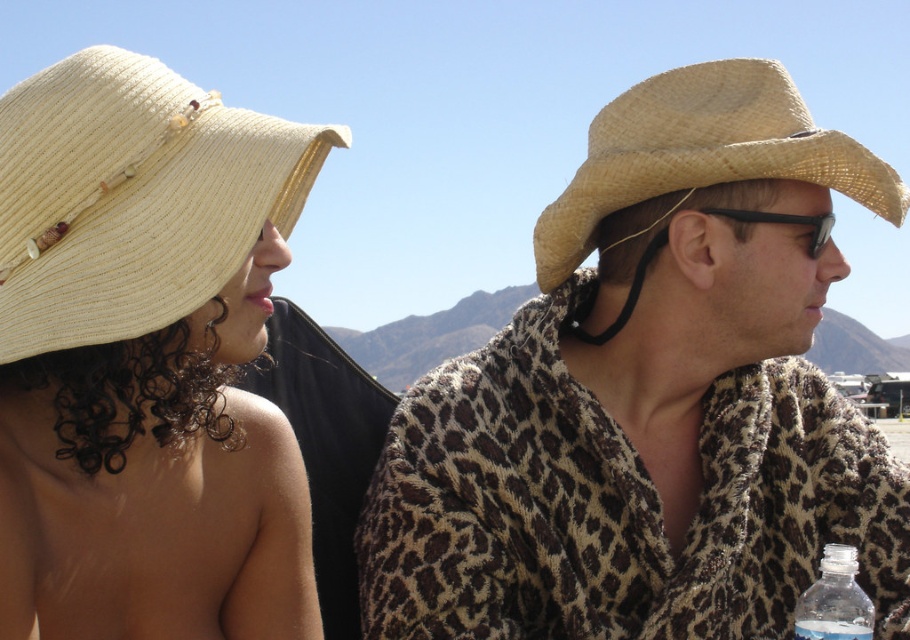
Does leopard print towel at center lie behind straw hat at left?

Yes, it is behind straw hat at left.

In the scene shown: Which is more to the left, leopard print towel at center or straw hat at left?

straw hat at left is more to the left.

Does point (659, 147) come farther from viewer compared to point (6, 276)?

Yes, it is.

I want to click on leopard print towel at center, so [650, 397].

Does point (836, 547) lie behind point (801, 221)?

That is False.

Can you confirm if clear plastic bottle at lower right is shorter than black plastic goggles at upper right?

Incorrect, clear plastic bottle at lower right's height does not fall short of black plastic goggles at upper right's.

Does point (816, 595) come in front of point (811, 246)?

Yes, it is in front of point (811, 246).

Find the location of a particular element. This screenshot has height=640, width=910. clear plastic bottle at lower right is located at coordinates (834, 600).

Is leopard print towel at center above straw hat at right?

Actually, leopard print towel at center is below straw hat at right.

Which of these two, leopard print towel at center or straw hat at right, stands taller?

leopard print towel at center is taller.

Describe the element at coordinates (650, 397) in the screenshot. This screenshot has height=640, width=910. I see `leopard print towel at center` at that location.

You are a GUI agent. You are given a task and a screenshot of the screen. Output one action in this format:
    pyautogui.click(x=<x>, y=<y>)
    Task: Click on the leopard print towel at center
    
    Given the screenshot: What is the action you would take?
    pyautogui.click(x=650, y=397)